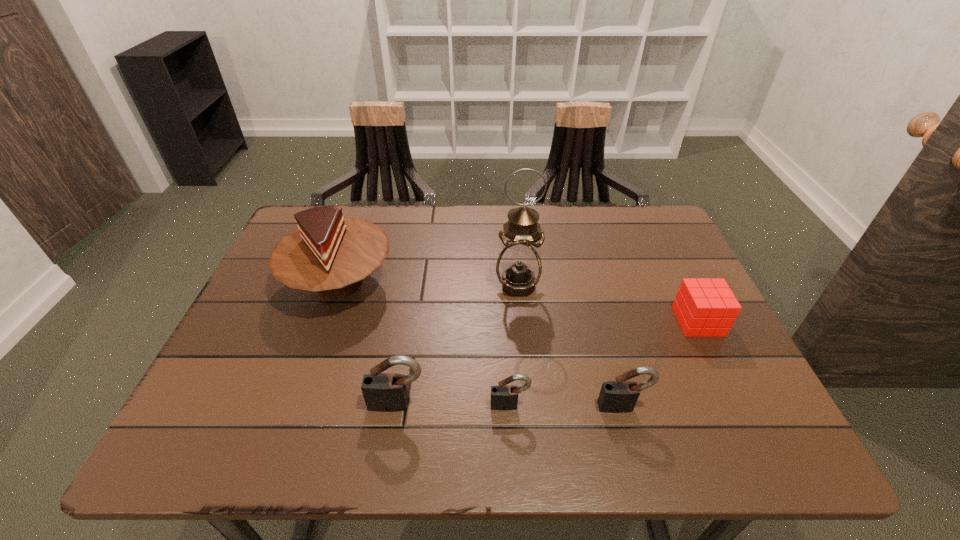
Find the location of a particular element. the tallest padlock is located at coordinates (383, 392).

Locate an element on the screen. Image resolution: width=960 pixels, height=540 pixels. the fourth shortest object is located at coordinates (383, 392).

The width and height of the screenshot is (960, 540). What are the coordinates of `the shortest padlock` in the screenshot? It's located at (504, 397).

Find the location of a particular element. This screenshot has height=540, width=960. the rightmost padlock is located at coordinates (620, 396).

Identify the location of the second tallest padlock. This screenshot has width=960, height=540. (620, 396).

Locate an element on the screen. The image size is (960, 540). cake is located at coordinates (330, 254).

The height and width of the screenshot is (540, 960). Find the location of `oil lamp`. oil lamp is located at coordinates (518, 267).

Locate an element on the screen. The height and width of the screenshot is (540, 960). cube is located at coordinates (704, 307).

Identify the location of vacant space located 0.080m on the right of the fifth shortest object. The image size is (960, 540). (425, 284).

Locate an element on the screen. blank space located on the right of the tallest object is located at coordinates (575, 285).